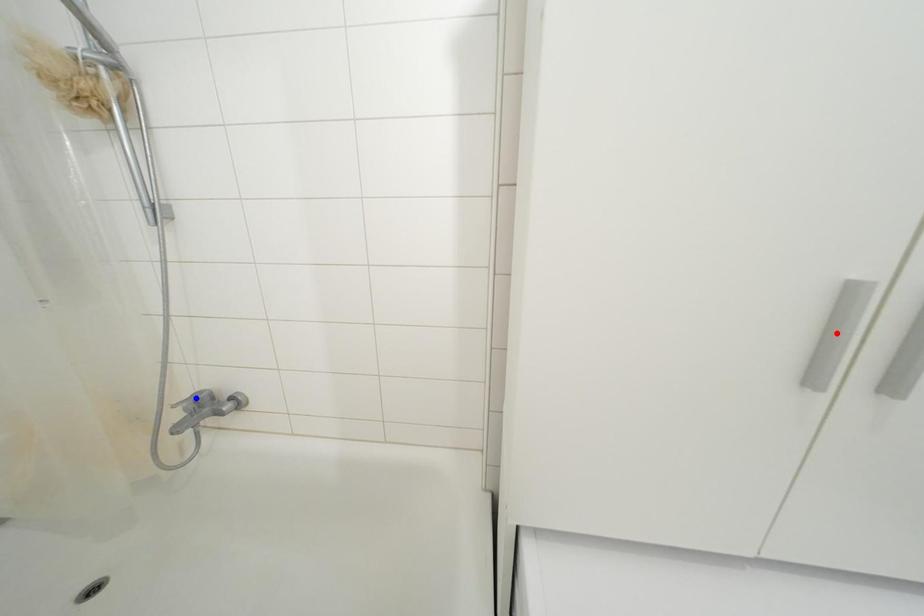
Question: In the image, two points are highlighted. Which point is nearer to the camera? Reply with the corresponding letter.

Choices:
 (A) blue point
 (B) red point

Answer: (B)